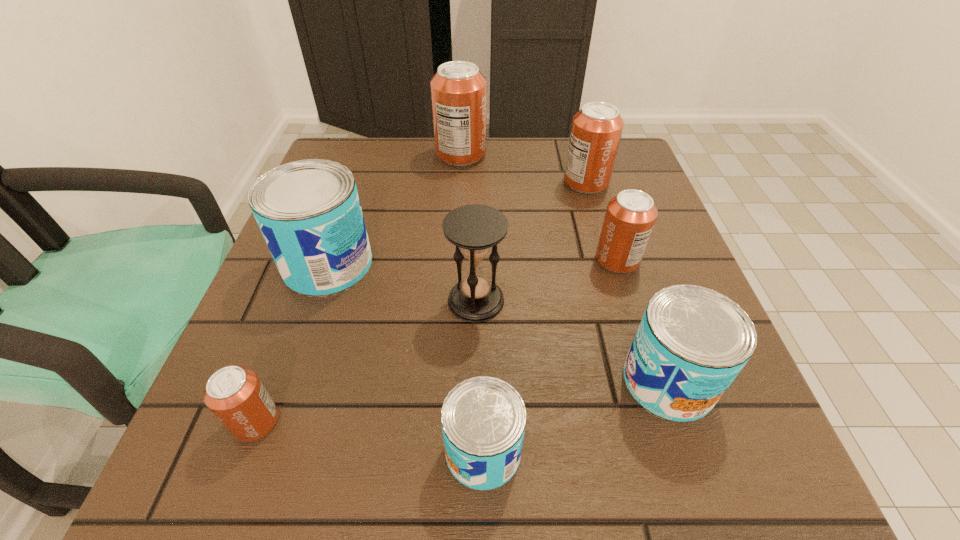
You are a GUI agent. You are given a task and a screenshot of the screen. Output one action in this format:
    pyautogui.click(x=<x>, y=<y>)
    Task: Click on the empty location between the hourglass and the nearest orange can
    The height and width of the screenshot is (540, 960).
    Given the screenshot: What is the action you would take?
    pyautogui.click(x=366, y=361)

Identify the location of vacant space in between the biggest blue can and the second biggest blue can. (498, 323).

At what (x,y) coordinates should I click in order to perform the action: click on vacant area between the smallest blue can and the rightmost blue can. Please return your answer as a coordinate pair (x, y). This screenshot has width=960, height=540. Looking at the image, I should click on (576, 416).

Locate an element on the screen. The image size is (960, 540). vacant area that lies between the hourglass and the third biggest orange can is located at coordinates (546, 280).

Locate which object is the second closest to the second smallest orange can. Please provide its 2D coordinates. Your answer should be formatted as a tuple, i.e. [(x, y)], where the tuple contains the x and y coordinates of a point satisfying the conditions above.

[(596, 130)]

Choose which object is the sixth nearest neighbor to the third smallest orange can. Please provide its 2D coordinates. Your answer should be formatted as a tuple, i.e. [(x, y)], where the tuple contains the x and y coordinates of a point satisfying the conditions above.

[(483, 419)]

Locate which can ranks in proximity to the rightmost blue can. Please provide its 2D coordinates. Your answer should be formatted as a tuple, i.e. [(x, y)], where the tuple contains the x and y coordinates of a point satisfying the conditions above.

[(630, 216)]

Select which can appears as the third closest to the second smallest blue can. Please provide its 2D coordinates. Your answer should be formatted as a tuple, i.e. [(x, y)], where the tuple contains the x and y coordinates of a point satisfying the conditions above.

[(596, 130)]

Locate which orange can ranks in proximity to the second smallest blue can. Please provide its 2D coordinates. Your answer should be formatted as a tuple, i.e. [(x, y)], where the tuple contains the x and y coordinates of a point satisfying the conditions above.

[(630, 216)]

Identify the location of orange can that stands as the fourth closest to the second smallest blue can. (458, 89).